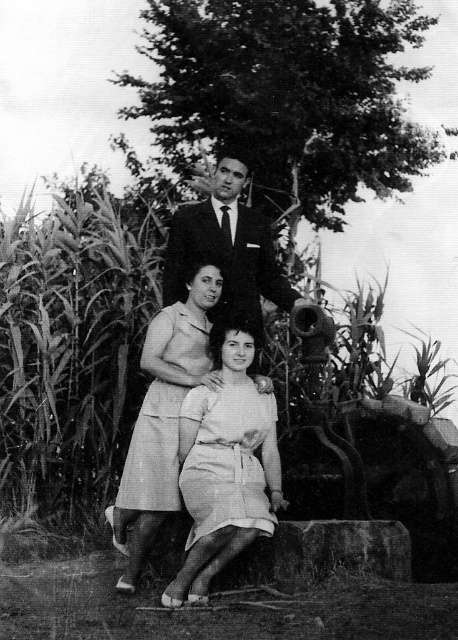
In the image described, there is a green leafy corn at upper left represented by point [71,346]. What is the spatial relationship between this point and the three individuals in the scene?

The green leafy corn at upper left represented by point [71,346] is located in the upper left corner of the image, which is outside the main grouping of the three individuals who are positioned in a tiered formation towards the center or lower part of the scene.